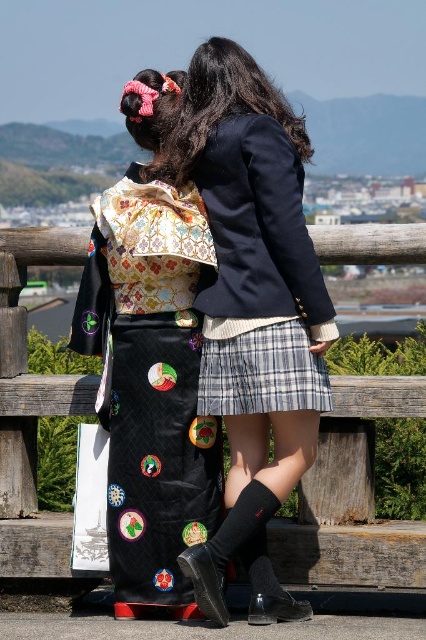
You are a photographer wanting to capture both the black quilted kimono at center and the plaid fabric skirt at center in a single shot. Which one is closer to you, the photographer?

The black quilted kimono at center is closer to you than the plaid fabric skirt at center, so it will appear larger in the photo.

You are a fashion designer observing the scene. You need to determine which item of clothing is bigger between the matte black blazer at center and the black leather boot at lower center. Which one is larger?

The matte black blazer at center is larger in size than the black leather boot at lower center.